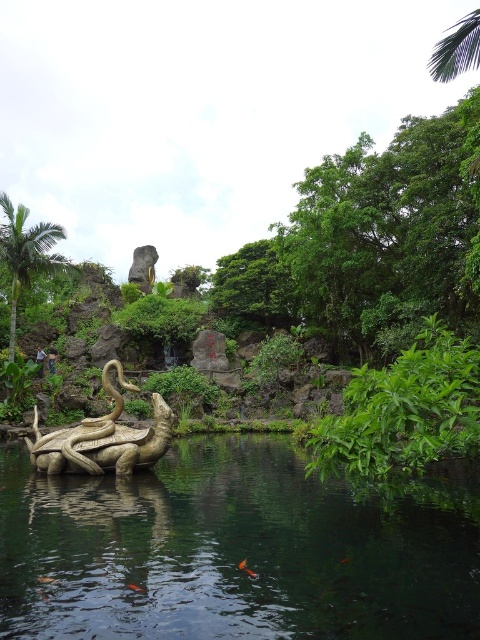
Looking at this image, is green leafy plant at center positioned behind green leafy tree at upper left?

No.

Is the position of green leafy plant at center less distant than that of green leafy tree at upper left?

Yes, green leafy plant at center is closer to the viewer.

This screenshot has height=640, width=480. Identify the location of green leafy plant at center. (405, 410).

Image resolution: width=480 pixels, height=640 pixels. I want to click on green leafy plant at center, so click(405, 410).

Which is more to the right, green leafy tree at upper right or orange glossy fish at lower center?

green leafy tree at upper right

Image resolution: width=480 pixels, height=640 pixels. Describe the element at coordinates (456, 49) in the screenshot. I see `green leafy tree at upper right` at that location.

Locate an element on the screen. This screenshot has width=480, height=640. green leafy tree at upper right is located at coordinates (456, 49).

Who is shorter, transparent water at center or shiny bronze octopus at center?

With less height is shiny bronze octopus at center.

Where is `transparent water at center`? The height and width of the screenshot is (640, 480). transparent water at center is located at coordinates (233, 552).